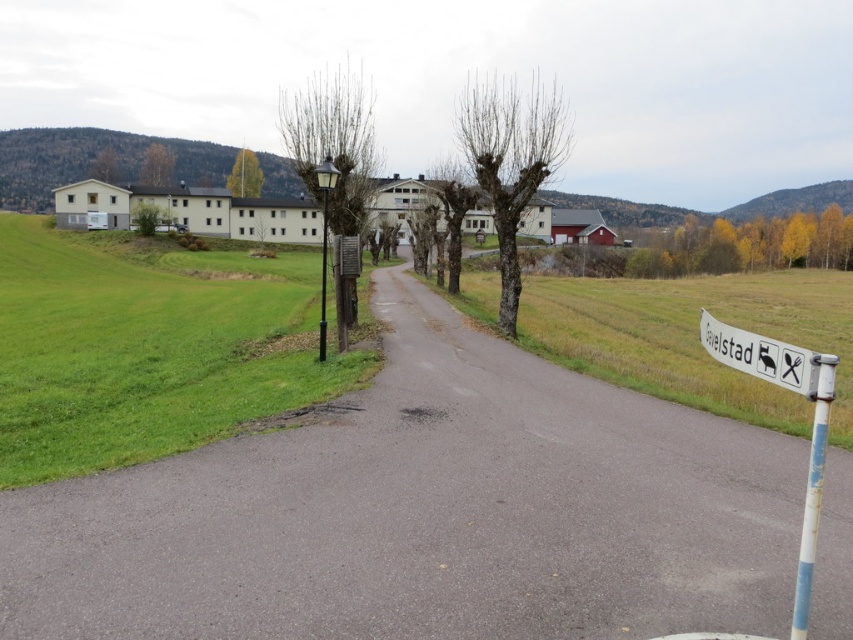
You are a pedestrian standing at the center of the road. You see a white plastic sign at right and a metallic pole at left. Which object is closer to you?

→ The white plastic sign at right is located below metallic pole at left, meaning the metallic pole at left is closer to you since it is above the sign.

You are a pedestrian walking along the road and want to reach the closest pole to you. Which pole should you head towards, the white painted metal pole at right or the metallic pole at left?

You should head towards the white painted metal pole at right because it is closer to the viewer than the metallic pole at left.